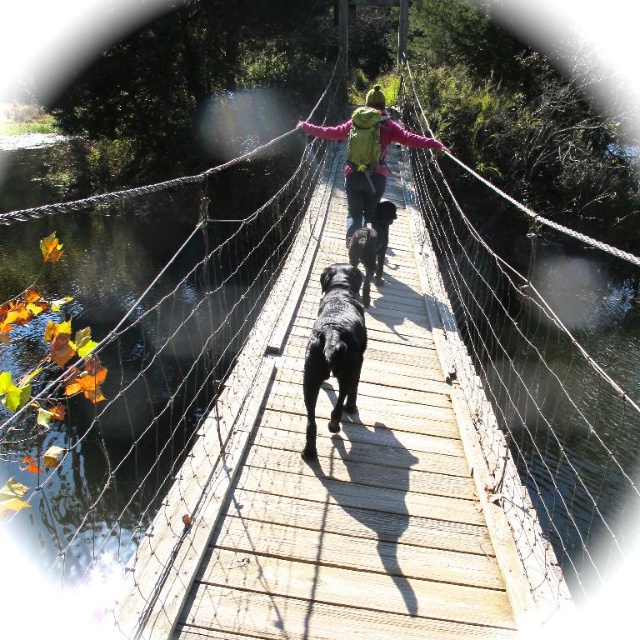
Can you confirm if shiny black dog at center is smaller than black matte dog at center?

Yes, shiny black dog at center is smaller than black matte dog at center.

Does point (326, 344) lie in front of point (372, 243)?

Yes.

Locate an element on the screen. This screenshot has width=640, height=640. shiny black dog at center is located at coordinates (333, 348).

Who is taller, green fabric backpack at center or black matte dog at center?

With more height is green fabric backpack at center.

Which is more to the right, green fabric backpack at center or black matte dog at center?

Positioned to the right is green fabric backpack at center.

Does point (349, 164) come closer to viewer compared to point (378, 269)?

No.

Where is `green fabric backpack at center`? This screenshot has width=640, height=640. green fabric backpack at center is located at coordinates (368, 154).

Which of these two, shiny black dog at center or green fabric backpack at center, stands shorter?

With less height is shiny black dog at center.

Between shiny black dog at center and green fabric backpack at center, which one is positioned lower?

shiny black dog at center is below.

The image size is (640, 640). What do you see at coordinates (333, 348) in the screenshot? I see `shiny black dog at center` at bounding box center [333, 348].

Find the location of a particular element. Image resolution: width=640 pixels, height=640 pixels. shiny black dog at center is located at coordinates (333, 348).